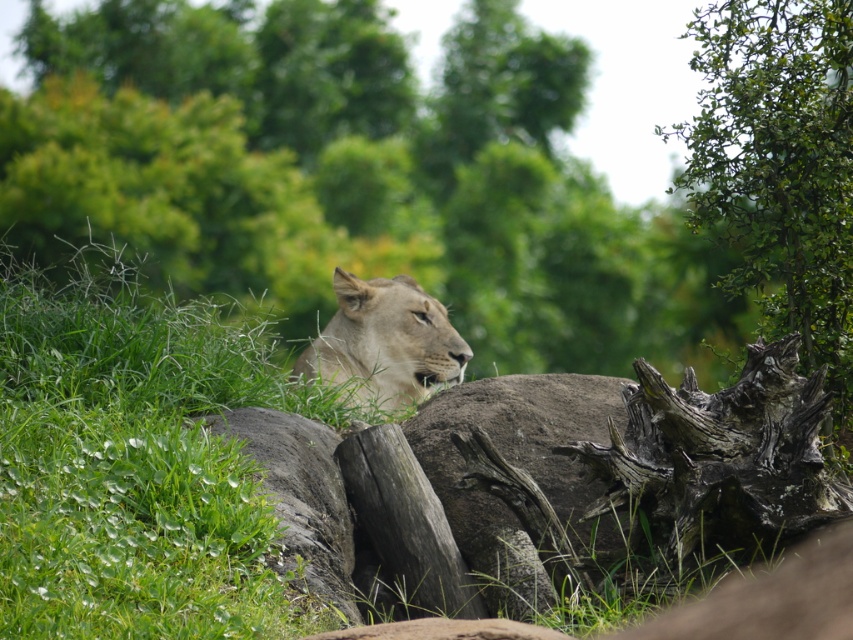
Question: Which point is farther to the camera?

Choices:
 (A) (416, 285)
 (B) (816, 268)

Answer: (A)

Question: Among these objects, which one is farthest from the camera?

Choices:
 (A) light brown fur lion at center
 (B) green leafy tree at right

Answer: (A)

Question: Is green leafy tree at right in front of light brown fur lion at center?

Choices:
 (A) yes
 (B) no

Answer: (A)

Question: Can you confirm if green leafy tree at right is thinner than light brown fur lion at center?

Choices:
 (A) no
 (B) yes

Answer: (B)

Question: Can you confirm if green leafy tree at right is wider than light brown fur lion at center?

Choices:
 (A) no
 (B) yes

Answer: (A)